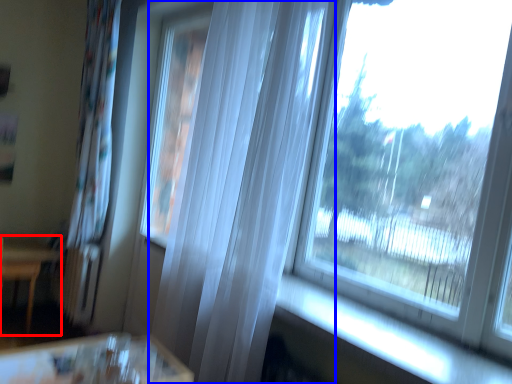
Question: Which object is closer to the camera taking this photo, furniture (highlighted by a red box) or curtain (highlighted by a blue box)?

Choices:
 (A) furniture
 (B) curtain

Answer: (B)